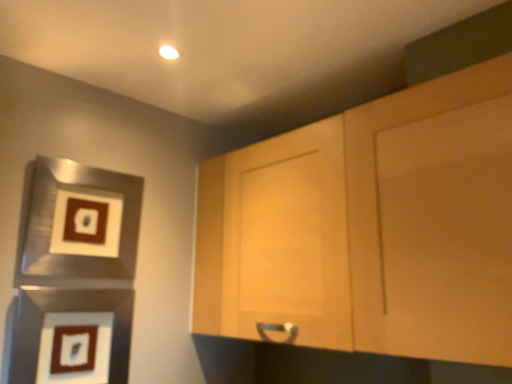
Describe the element at coordinates (370, 226) in the screenshot. The image size is (512, 384). I see `light wood cabinet at upper right` at that location.

This screenshot has height=384, width=512. What do you see at coordinates (31, 335) in the screenshot?
I see `matte black picture frame at lower left, the 1th picture frame when ordered from bottom to top` at bounding box center [31, 335].

Image resolution: width=512 pixels, height=384 pixels. In order to click on light wood cabinet at upper right in this screenshot , I will do `click(370, 226)`.

Locate an element on the screen. picture frame on the left of brushed metal picture frame at left, which appears as the 1th picture frame when viewed from the top is located at coordinates (31, 335).

Is there a large distance between brushed metal picture frame at left, the 2th picture frame when ordered from bottom to top, and matte black picture frame at lower left, the 1th picture frame when ordered from bottom to top?

That's not correct — brushed metal picture frame at left, the 2th picture frame when ordered from bottom to top, is a little close to matte black picture frame at lower left, the 1th picture frame when ordered from bottom to top.

From the image's perspective, is brushed metal picture frame at left, which appears as the 1th picture frame when viewed from the top, positioned above or below matte black picture frame at lower left, the 1th picture frame when ordered from bottom to top?

Based on their image positions, brushed metal picture frame at left, which appears as the 1th picture frame when viewed from the top, is located above matte black picture frame at lower left, the 1th picture frame when ordered from bottom to top.

Which object is closer to the camera taking this photo, light wood cabinet at upper right or brushed metal picture frame at left, which appears as the 1th picture frame when viewed from the top?

light wood cabinet at upper right is more forward.

Is light wood cabinet at upper right taller than brushed metal picture frame at left, which appears as the 1th picture frame when viewed from the top?

Yes.

In the scene shown: Would you say light wood cabinet at upper right contains brushed metal picture frame at left, which appears as the 1th picture frame when viewed from the top?

Definitely not — brushed metal picture frame at left, which appears as the 1th picture frame when viewed from the top, is not inside light wood cabinet at upper right.

I want to click on cabinetry below the brushed metal picture frame at left, which appears as the 1th picture frame when viewed from the top (from a real-world perspective), so click(370, 226).

Looking at this image, considering the positions of objects brushed metal picture frame at left, which appears as the 1th picture frame when viewed from the top, and light wood cabinet at upper right in the image provided, who is more to the right, brushed metal picture frame at left, which appears as the 1th picture frame when viewed from the top, or light wood cabinet at upper right?

Positioned to the right is light wood cabinet at upper right.

Which is less distant, (76, 277) or (507, 364)?

Clearly, point (76, 277) is more distant from the camera than point (507, 364).

Which object is more forward, brushed metal picture frame at left, which appears as the 1th picture frame when viewed from the top, or light wood cabinet at upper right?

light wood cabinet at upper right is in front.

Is brushed metal picture frame at left, the 2th picture frame when ordered from bottom to top, touching light wood cabinet at upper right?

No, brushed metal picture frame at left, the 2th picture frame when ordered from bottom to top, is not beside light wood cabinet at upper right.

Would you say matte black picture frame at lower left, positioned as the second picture frame in top-to-bottom order, is outside light wood cabinet at upper right?

Yes, matte black picture frame at lower left, positioned as the second picture frame in top-to-bottom order, is located beyond the bounds of light wood cabinet at upper right.

From the image's perspective, relative to light wood cabinet at upper right, is matte black picture frame at lower left, positioned as the second picture frame in top-to-bottom order, above or below?

From the image's perspective, matte black picture frame at lower left, positioned as the second picture frame in top-to-bottom order, appears below light wood cabinet at upper right.

Is matte black picture frame at lower left, positioned as the second picture frame in top-to-bottom order, positioned with its back to light wood cabinet at upper right?

No, matte black picture frame at lower left, positioned as the second picture frame in top-to-bottom order,'s orientation is not away from light wood cabinet at upper right.

Is the depth of matte black picture frame at lower left, the 1th picture frame when ordered from bottom to top, less than that of light wood cabinet at upper right?

No.

Which object is positioned more to the right, matte black picture frame at lower left, the 1th picture frame when ordered from bottom to top, or brushed metal picture frame at left, which appears as the 1th picture frame when viewed from the top?

Positioned to the right is brushed metal picture frame at left, which appears as the 1th picture frame when viewed from the top.

In the scene shown: What's the angular difference between matte black picture frame at lower left, the 1th picture frame when ordered from bottom to top, and brushed metal picture frame at left, the 2th picture frame when ordered from bottom to top,'s facing directions?

The angular difference between matte black picture frame at lower left, the 1th picture frame when ordered from bottom to top, and brushed metal picture frame at left, the 2th picture frame when ordered from bottom to top, is 0.00223 degrees.

From the image's perspective, is matte black picture frame at lower left, the 1th picture frame when ordered from bottom to top, on brushed metal picture frame at left, the 2th picture frame when ordered from bottom to top?

No, from the image's perspective, matte black picture frame at lower left, the 1th picture frame when ordered from bottom to top, is not over brushed metal picture frame at left, the 2th picture frame when ordered from bottom to top.

From the picture: Visually, is light wood cabinet at upper right positioned to the left or to the right of matte black picture frame at lower left, the 1th picture frame when ordered from bottom to top?

light wood cabinet at upper right is to the right of matte black picture frame at lower left, the 1th picture frame when ordered from bottom to top.

Is light wood cabinet at upper right in front of matte black picture frame at lower left, positioned as the second picture frame in top-to-bottom order?

Yes, it is.

From the image's perspective, which one is positioned higher, light wood cabinet at upper right or matte black picture frame at lower left, positioned as the second picture frame in top-to-bottom order?

From the image's view, light wood cabinet at upper right is above.

From the picture: Is light wood cabinet at upper right inside the boundaries of matte black picture frame at lower left, the 1th picture frame when ordered from bottom to top, or outside?

The correct answer is: outside.

The width and height of the screenshot is (512, 384). Find the location of `picture frame to the right of matte black picture frame at lower left, the 1th picture frame when ordered from bottom to top`. picture frame to the right of matte black picture frame at lower left, the 1th picture frame when ordered from bottom to top is located at coordinates (78, 227).

Locate an element on the screen. cabinetry that is in front of the brushed metal picture frame at left, which appears as the 1th picture frame when viewed from the top is located at coordinates (370, 226).

Considering their positions, is light wood cabinet at upper right positioned further to brushed metal picture frame at left, which appears as the 1th picture frame when viewed from the top, than matte black picture frame at lower left, positioned as the second picture frame in top-to-bottom order?

light wood cabinet at upper right is positioned further to the anchor brushed metal picture frame at left, which appears as the 1th picture frame when viewed from the top.

Considering their positions, is brushed metal picture frame at left, the 2th picture frame when ordered from bottom to top, positioned further to light wood cabinet at upper right than matte black picture frame at lower left, positioned as the second picture frame in top-to-bottom order?

The object further to light wood cabinet at upper right is matte black picture frame at lower left, positioned as the second picture frame in top-to-bottom order.

Estimate the real-world distances between objects in this image. Which object is further from brushed metal picture frame at left, the 2th picture frame when ordered from bottom to top, matte black picture frame at lower left, positioned as the second picture frame in top-to-bottom order, or light wood cabinet at upper right?

light wood cabinet at upper right lies further to brushed metal picture frame at left, the 2th picture frame when ordered from bottom to top, than the other object.

Based on their spatial positions, is light wood cabinet at upper right or brushed metal picture frame at left, which appears as the 1th picture frame when viewed from the top, further from matte black picture frame at lower left, positioned as the second picture frame in top-to-bottom order?

light wood cabinet at upper right is positioned further to the anchor matte black picture frame at lower left, positioned as the second picture frame in top-to-bottom order.

Which object lies nearer to the anchor point matte black picture frame at lower left, positioned as the second picture frame in top-to-bottom order, brushed metal picture frame at left, the 2th picture frame when ordered from bottom to top, or light wood cabinet at upper right?

The object closer to matte black picture frame at lower left, positioned as the second picture frame in top-to-bottom order, is brushed metal picture frame at left, the 2th picture frame when ordered from bottom to top.

Estimate the real-world distances between objects in this image. Which object is further from light wood cabinet at upper right, matte black picture frame at lower left, positioned as the second picture frame in top-to-bottom order, or brushed metal picture frame at left, the 2th picture frame when ordered from bottom to top?

Among the two, matte black picture frame at lower left, positioned as the second picture frame in top-to-bottom order, is located further to light wood cabinet at upper right.

The image size is (512, 384). I want to click on picture frame situated between matte black picture frame at lower left, the 1th picture frame when ordered from bottom to top, and light wood cabinet at upper right from left to right, so click(78, 227).